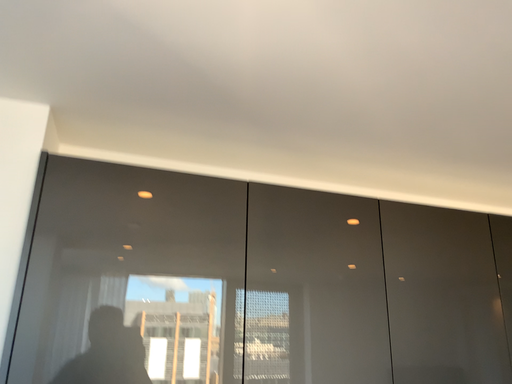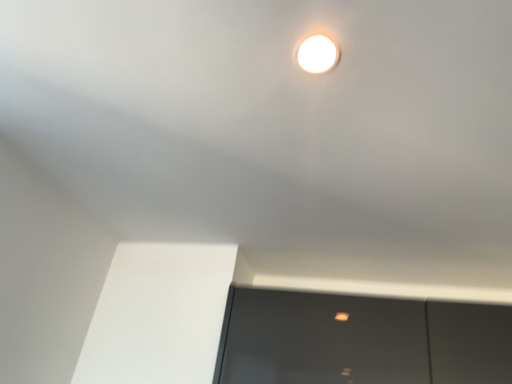
Question: How did the camera likely rotate when shooting the video?

Choices:
 (A) rotated left
 (B) rotated right

Answer: (A)